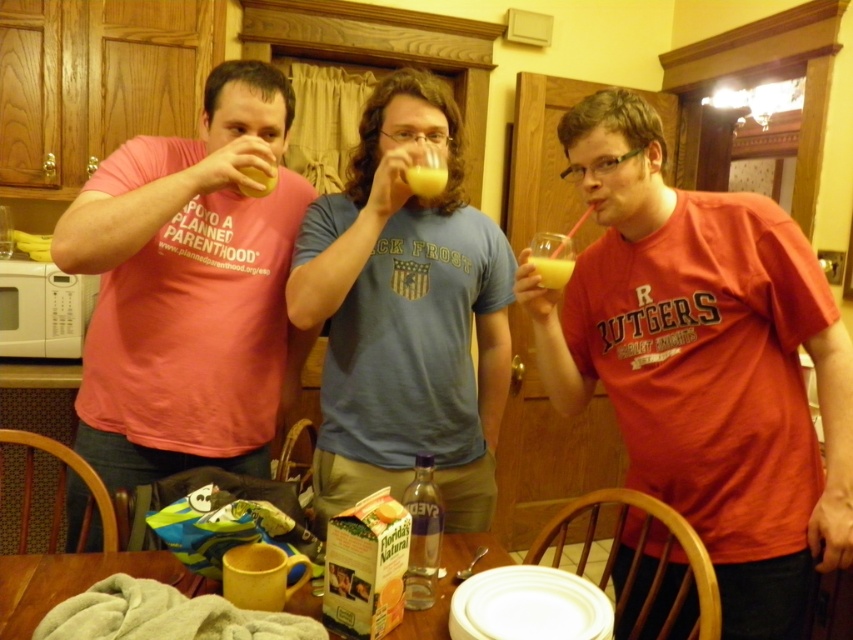
Question: Does translucent glass at center lie in front of yellow liquid at upper center?

Choices:
 (A) no
 (B) yes

Answer: (B)

Question: Which object appears farthest from the camera in this image?

Choices:
 (A) clear glass bottle at center
 (B) yellow liquid at upper center
 (C) yellow translucent liquid at center

Answer: (B)

Question: Is white matte microwave at left smaller than yellow translucent liquid at center?

Choices:
 (A) no
 (B) yes

Answer: (A)

Question: Which is farther from the clear glass bottle at center?

Choices:
 (A) yellow translucent liquid at center
 (B) matte red t-shirt at center
 (C) translucent glass at center

Answer: (A)

Question: Is yellow translucent liquid at center positioned in front of yellow liquid at upper center?

Choices:
 (A) no
 (B) yes

Answer: (B)

Question: Which point is closer to the camera?

Choices:
 (A) (177, 218)
 (B) (432, 156)

Answer: (B)